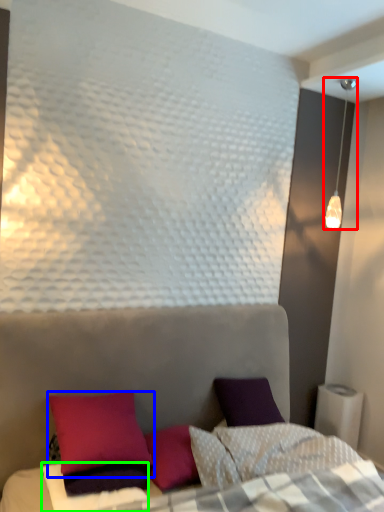
Question: Which is farther away from lamp (highlighted by a red box)? pillow (highlighted by a blue box) or sheet (highlighted by a green box)?

Choices:
 (A) pillow
 (B) sheet

Answer: (B)